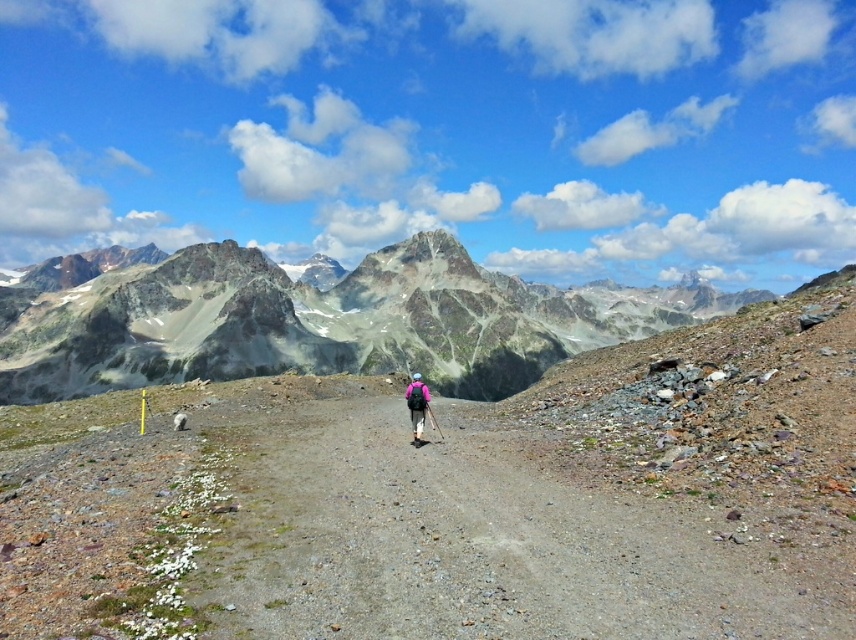
Is brown gravel path at center above pink fabric backpack at center?

Incorrect, brown gravel path at center is not positioned above pink fabric backpack at center.

Does brown gravel path at center have a lesser width compared to pink fabric backpack at center?

In fact, brown gravel path at center might be wider than pink fabric backpack at center.

At what (x,y) coordinates should I click in order to perform the action: click on brown gravel path at center. Please return your answer as a coordinate pair (x, y). The image size is (856, 640). Looking at the image, I should click on (474, 545).

Measure the distance between rocky snow-capped mountains at center and camera.

rocky snow-capped mountains at center is 435.07 feet from camera.

What do you see at coordinates (322, 321) in the screenshot?
I see `rocky snow-capped mountains at center` at bounding box center [322, 321].

Where is `rocky snow-capped mountains at center`? The height and width of the screenshot is (640, 856). rocky snow-capped mountains at center is located at coordinates (322, 321).

Does point (254, 566) come behind point (260, 314)?

No, (254, 566) is closer to viewer.

Does brown gravel path at center have a greater width compared to rocky snow-capped mountains at center?

No.

Who is more distant from viewer, (797, 589) or (508, 372)?

Point (508, 372)

Identify the location of brown gravel path at center. This screenshot has width=856, height=640. (474, 545).